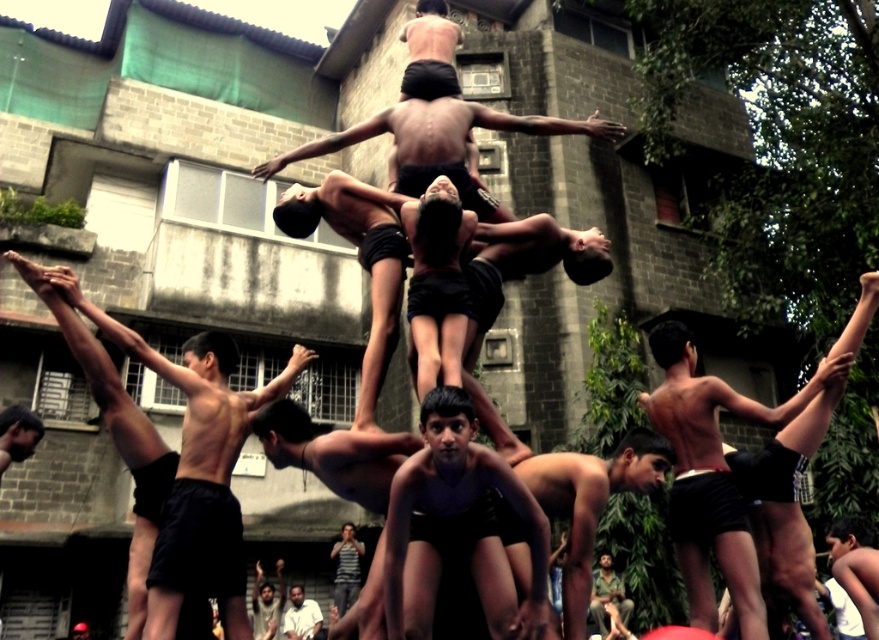
Is brown leather jacket at lower center wider than dark skin human at center?

Yes.

Does brown leather jacket at lower center come in front of dark skin human at center?

Yes, brown leather jacket at lower center is in front of dark skin human at center.

Does point (611, 582) lie behind point (260, 573)?

No, it is not.

Image resolution: width=879 pixels, height=640 pixels. Find the location of `brown leather jacket at lower center`. brown leather jacket at lower center is located at coordinates (608, 595).

Which of these two, black matte shorts at center or brown leather jacket at lower center, stands shorter?

brown leather jacket at lower center

Is black matte shorts at center behind brown leather jacket at lower center?

No, it is in front of brown leather jacket at lower center.

What do you see at coordinates (718, 404) in the screenshot? I see `black matte shorts at center` at bounding box center [718, 404].

What are the coordinates of `black matte shorts at center` in the screenshot? It's located at (718, 404).

Which is behind, point (522, 614) or point (604, 596)?

Positioned behind is point (604, 596).

Who is positioned more to the right, dark blue shorts at center or brown leather jacket at lower center?

brown leather jacket at lower center

Locate an element on the screen. This screenshot has width=879, height=640. dark blue shorts at center is located at coordinates (462, 518).